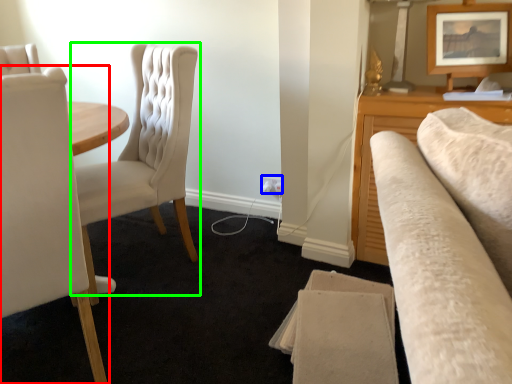
Question: Which is farther away from chair (highlighted by a red box)? electric outlet (highlighted by a blue box) or chair (highlighted by a green box)?

Choices:
 (A) electric outlet
 (B) chair

Answer: (A)